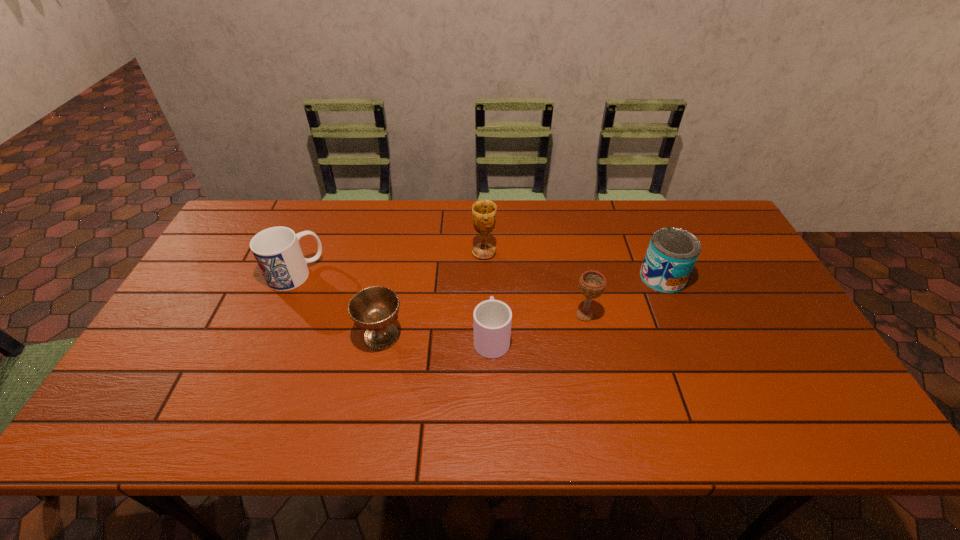
Locate an element on the screen. The image size is (960, 540). blank space at the far left corner is located at coordinates (276, 211).

Locate an element on the screen. This screenshot has width=960, height=540. free location at the far right corner of the desktop is located at coordinates (725, 237).

Identify the location of free space between the rightmost object and the second object from right to left. coord(623,296).

Find the location of a particular element. The width and height of the screenshot is (960, 540). free spot between the cup and the fifth object from left to right is located at coordinates (538, 326).

The width and height of the screenshot is (960, 540). Find the location of `free area in between the can and the leftmost object`. free area in between the can and the leftmost object is located at coordinates (479, 276).

Where is `free spot between the tallest chalice and the second object from left to right`? free spot between the tallest chalice and the second object from left to right is located at coordinates (433, 294).

Locate an element on the screen. This screenshot has width=960, height=540. vacant region between the farthest chalice and the fifth object from left to right is located at coordinates (534, 284).

Locate an element on the screen. Image resolution: width=960 pixels, height=540 pixels. vacant space that's between the can and the tallest object is located at coordinates (573, 265).

Where is `free spot between the cup and the tallest object`? free spot between the cup and the tallest object is located at coordinates (488, 295).

In order to click on vacant area that lies between the rightmost object and the mug in this screenshot , I will do `click(479, 276)`.